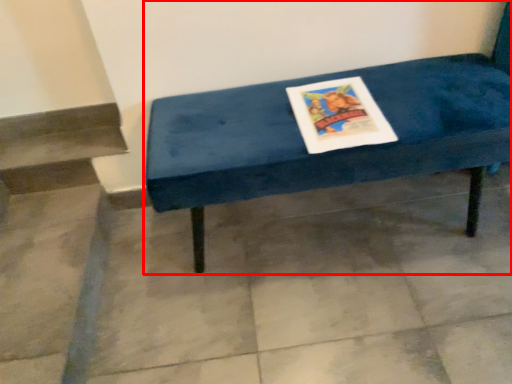
Question: From the image, what is the correct spatial relationship of furniture (annotated by the red box) in relation to concrete?

Choices:
 (A) left
 (B) right

Answer: (B)